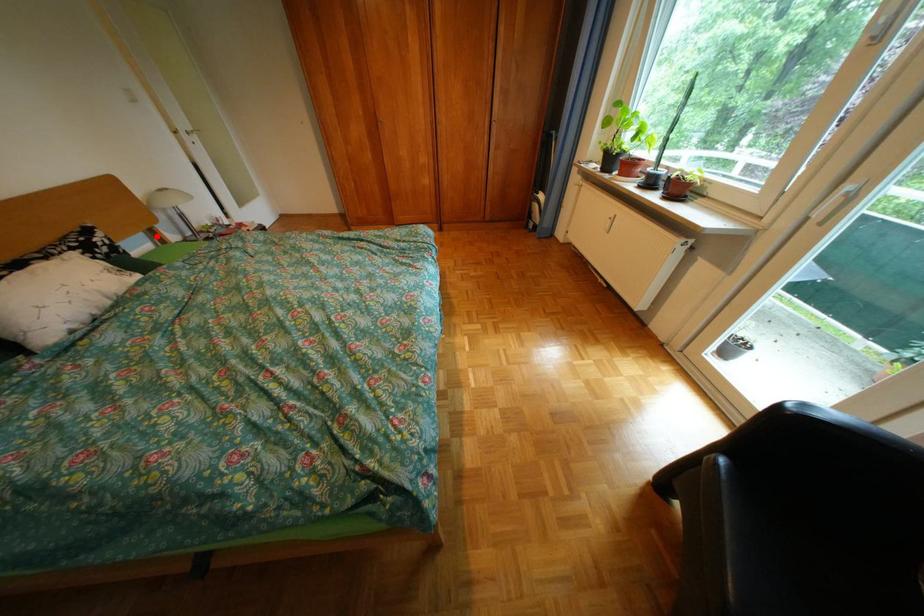
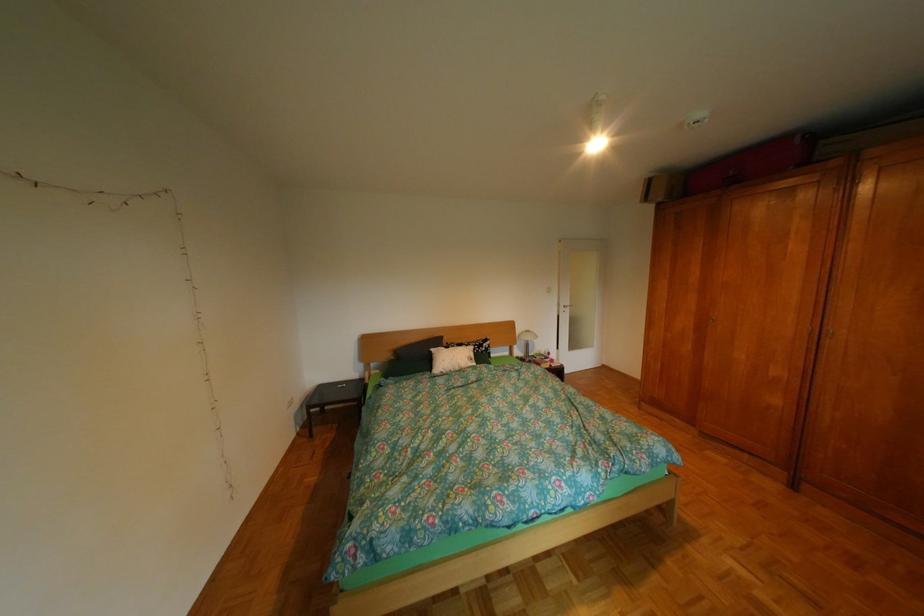
The point at the highlighted location is marked in the first image. Where is the corresponding point in the second image?

(523, 349)